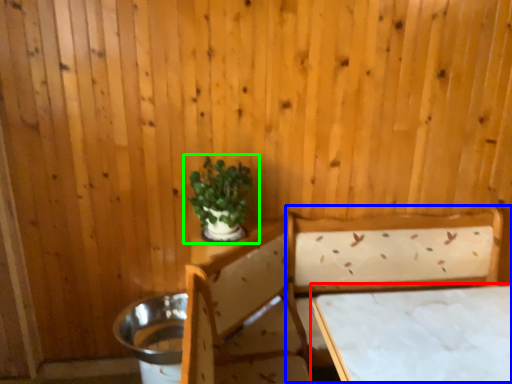
Question: Which object is the closest to the table (highlighted by a red box)? Choose among these: bed (highlighted by a blue box) or houseplant (highlighted by a green box).

Choices:
 (A) bed
 (B) houseplant

Answer: (A)